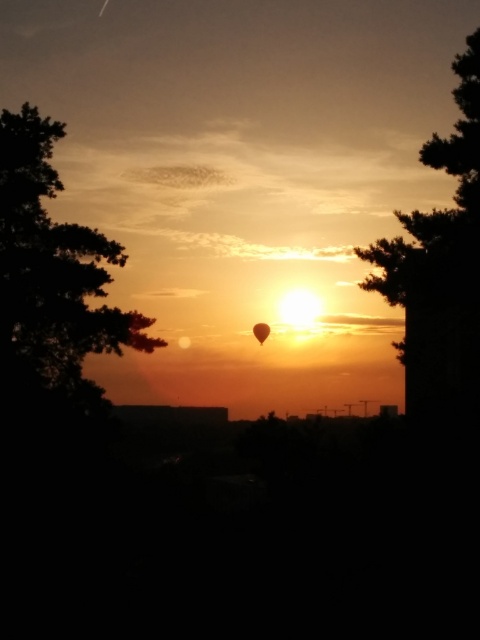
Question: Among these points, which one is nearest to the camera?

Choices:
 (A) (259, 323)
 (B) (422, 364)

Answer: (B)

Question: Considering the relative positions of silhouette leafy tree at left and silky brown tree at right in the image provided, where is silhouette leafy tree at left located with respect to silky brown tree at right?

Choices:
 (A) above
 (B) below

Answer: (A)

Question: Which of the following is the farthest from the observer?

Choices:
 (A) silhouette leafy tree at left
 (B) translucent orange balloon at center

Answer: (B)

Question: Is silhouette leafy tree at left to the left of translucent orange balloon at center from the viewer's perspective?

Choices:
 (A) no
 (B) yes

Answer: (B)

Question: Does silhouette leafy tree at left have a smaller size compared to translucent orange balloon at center?

Choices:
 (A) no
 (B) yes

Answer: (A)

Question: Which object is farther from the camera taking this photo?

Choices:
 (A) translucent orange balloon at center
 (B) silhouette leafy tree at left

Answer: (A)